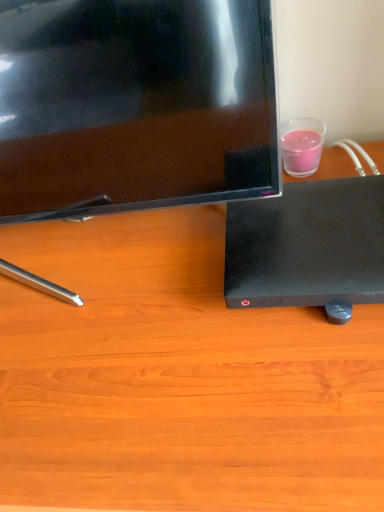
Where is `blank space situated above black plastic desktop at lower right (from a real-world perspective)`? This screenshot has width=384, height=512. blank space situated above black plastic desktop at lower right (from a real-world perspective) is located at coordinates (306, 234).